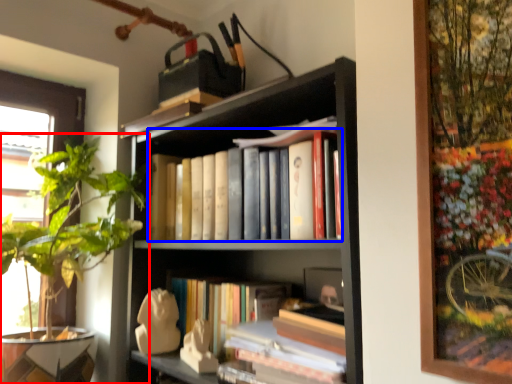
Question: Which of the following is the farthest to the observer, houseplant (highlighted by a red box) or book (highlighted by a blue box)?

Choices:
 (A) houseplant
 (B) book

Answer: (B)